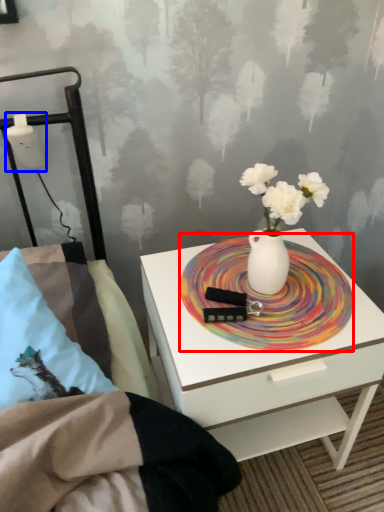
Question: Which object appears closest to the camera in this image, platter (highlighted by a red box) or table lamp (highlighted by a blue box)?

Choices:
 (A) platter
 (B) table lamp

Answer: (A)